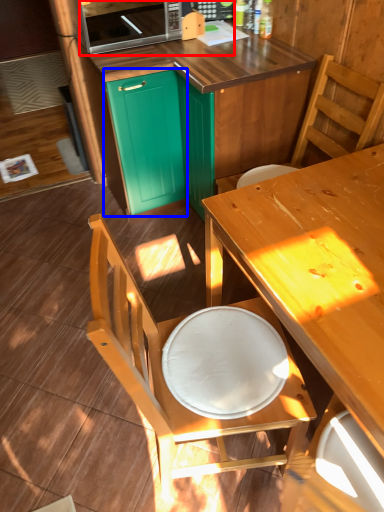
Question: Which object appears farthest to the camera in this image, microwave oven (highlighted by a red box) or cabinetry (highlighted by a blue box)?

Choices:
 (A) microwave oven
 (B) cabinetry

Answer: (B)